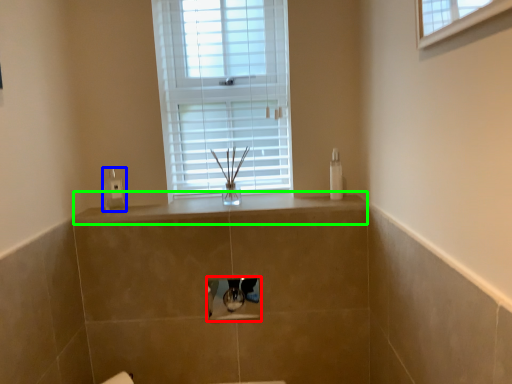
Question: Which object is positioned farthest from medicine cabinet (highlighted by a red box)? Select from soap dispenser (highlighted by a blue box) and counter top (highlighted by a green box).

Choices:
 (A) soap dispenser
 (B) counter top

Answer: (A)